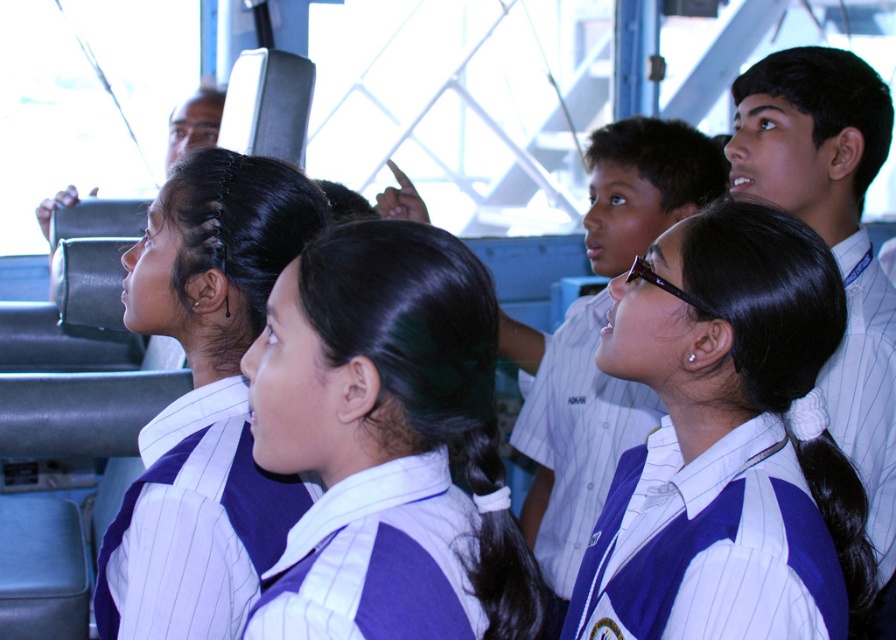
You are a photographer positioned outside the vehicle. You want to take a photo of the blue pinstriped baseball uniform at center and the black silky hair at center through the window. The camera lens has a maximum focus range of 12 inches. Can you capture both subjects clearly in one shot?

The distance between the blue pinstriped baseball uniform at center and the black silky hair at center is 12.45 inches. Since the camera lens can only focus up to 12 inches, the subjects are slightly beyond the focus range, so both cannot be captured clearly in one shot.

What are the coordinates of the blue pinstriped baseball uniform at center?

The blue pinstriped baseball uniform at center is located at coordinates point (709,545).

You are a photographer trying to capture a clear shot of the blue striped shirt at center and the black silky hair at center from the front of the vehicle. Can you see both subjects fully without any obstruction?

The black silky hair at center is behind the blue striped shirt at center, so you cannot see both subjects fully without obstruction as the blue striped shirt at center is blocking the view of the black silky hair at center from the front.